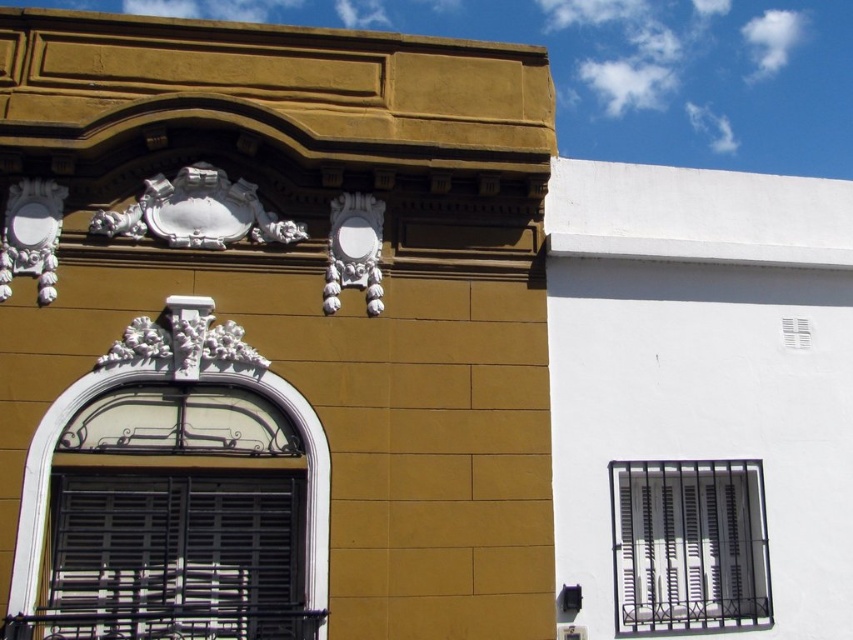
Is metallic gray bars at center smaller than white matte window at center?

Correct, metallic gray bars at center occupies less space than white matte window at center.

Image resolution: width=853 pixels, height=640 pixels. What are the coordinates of `metallic gray bars at center` in the screenshot? It's located at (689, 545).